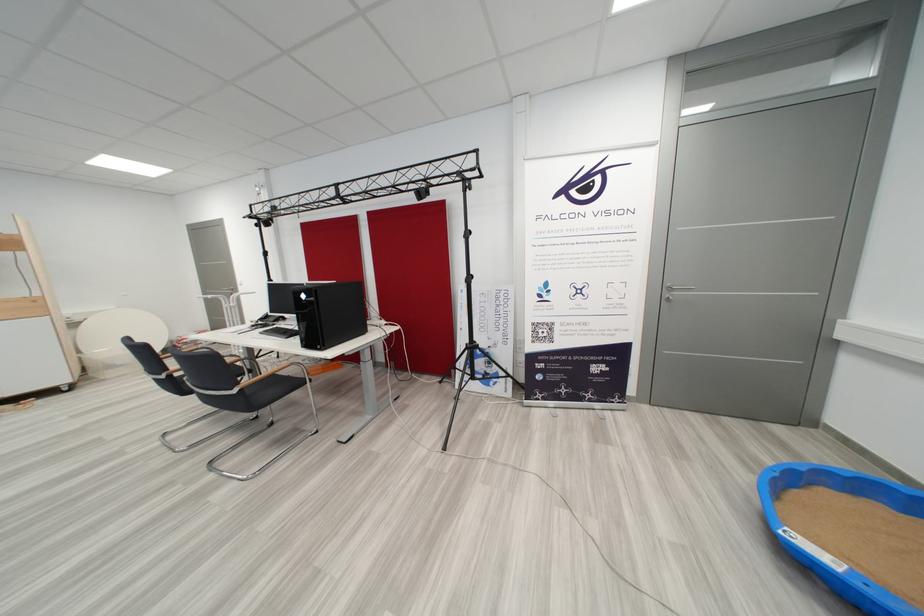
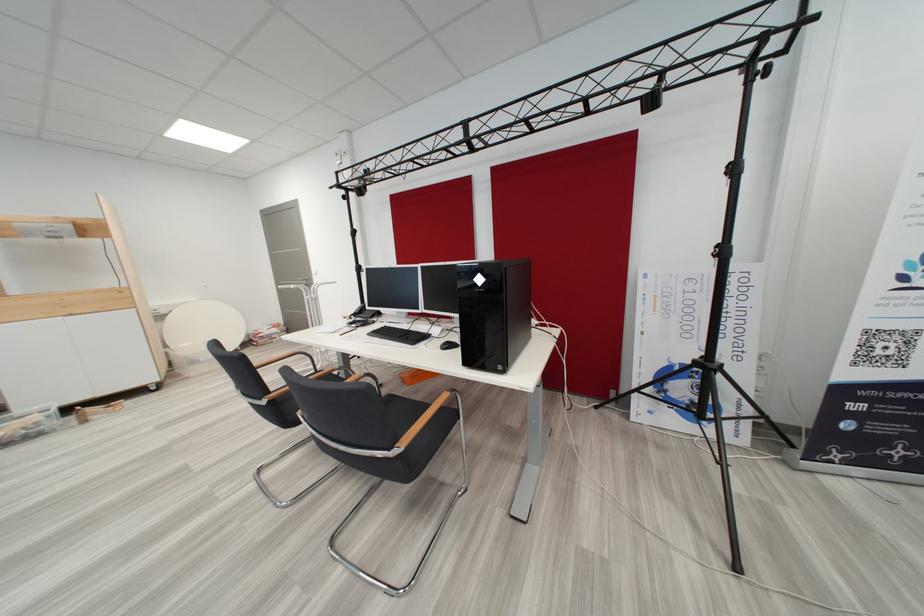
What movement of the cameraman would produce the second image?

The movement direction of the cameraman is left, forward.